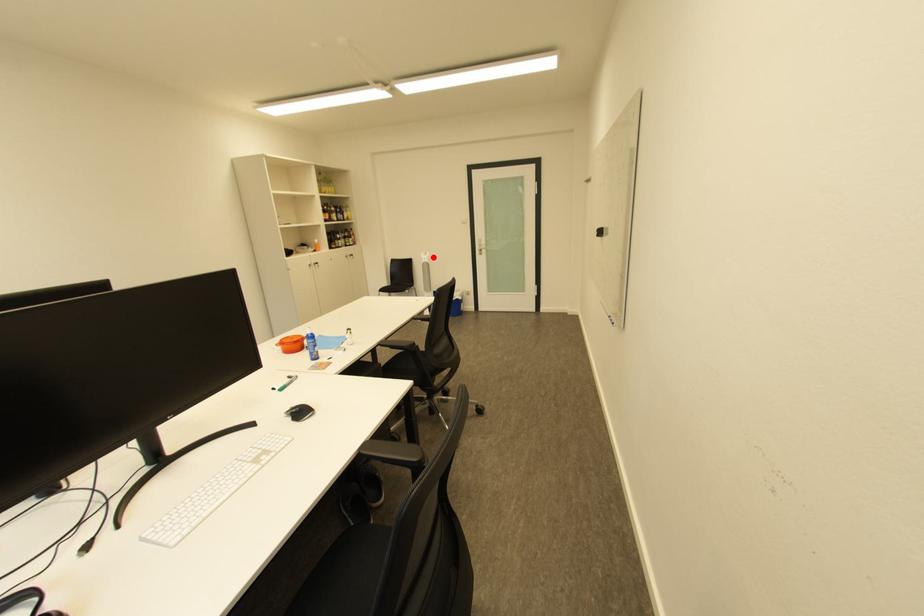
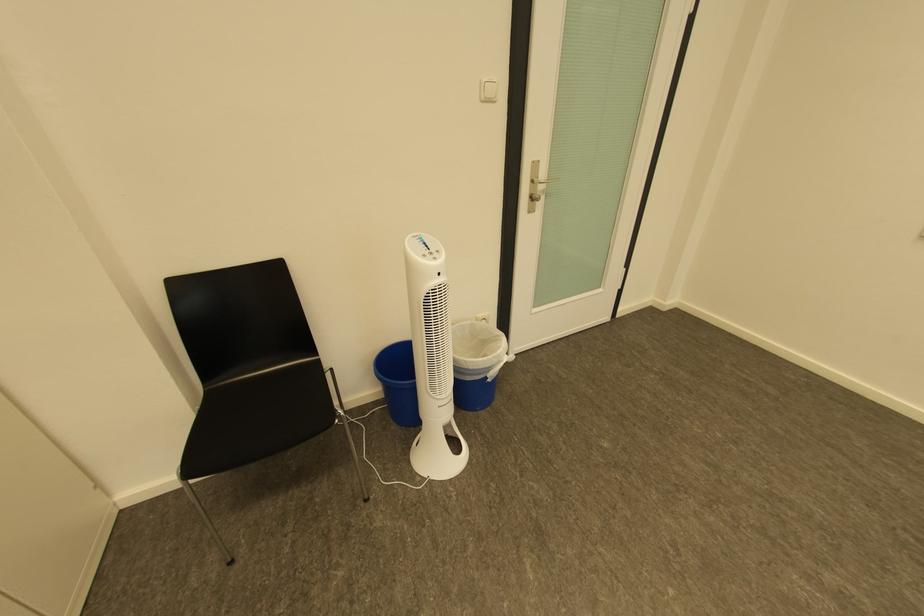
Question: A red point is marked in image1. In image2, is the corresponding 3D point closer to the camera or farther? Reply with the corresponding letter.

Choices:
 (A) The corresponding 3D point is closer.
 (B) The corresponding 3D point is farther.

Answer: (B)